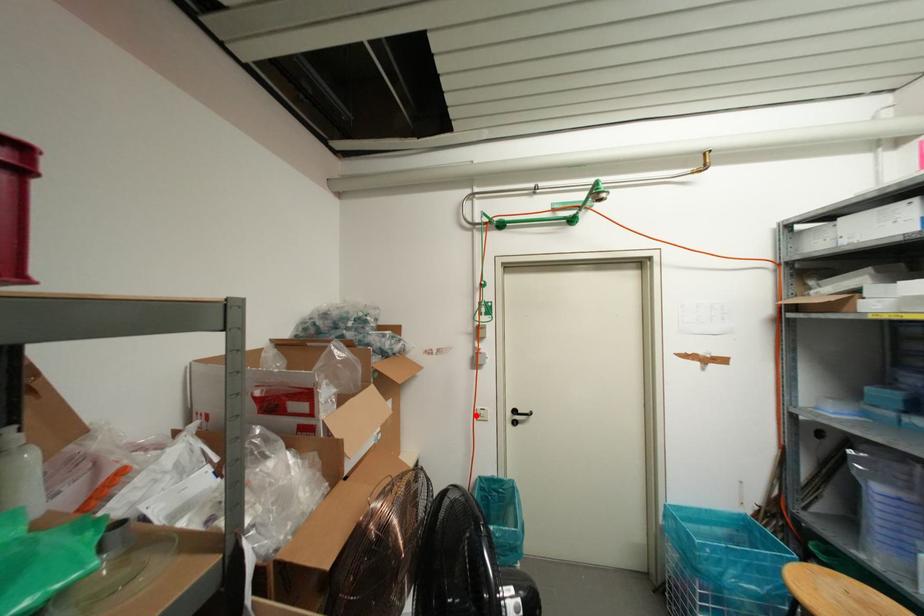
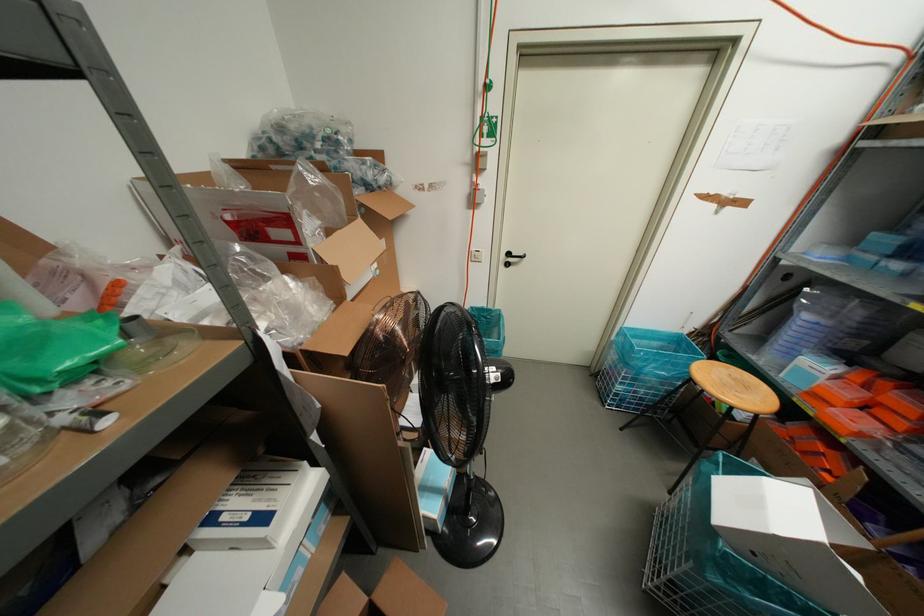
The point at the highlighted location is marked in the first image. Where is the corresponding point in the second image?

(470, 257)